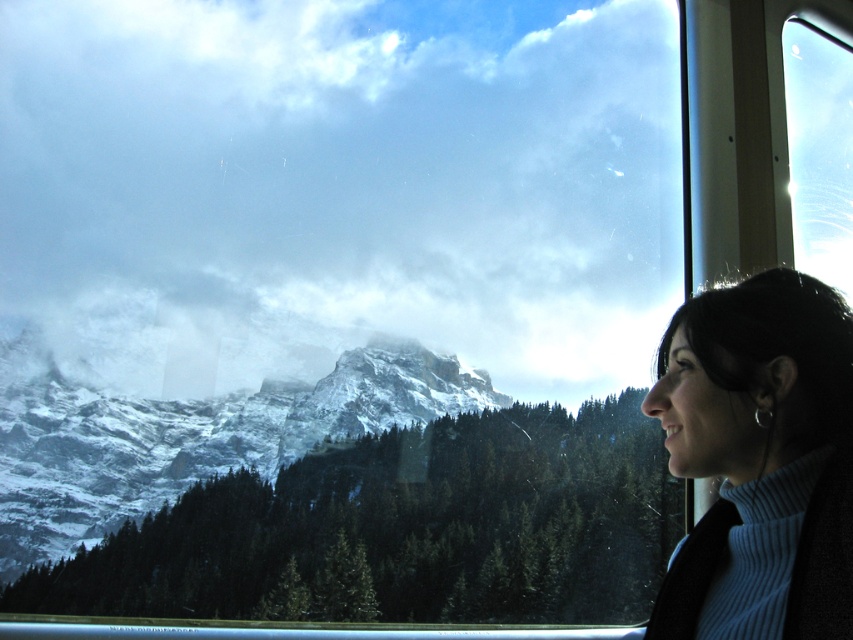
Question: Which is nearer to the transparent glass window at upper right?

Choices:
 (A) snowy rock mountain at center
 (B) light blue turtleneck sweater at right

Answer: (B)

Question: Which of the following is the farthest from the observer?

Choices:
 (A) (790, 561)
 (B) (39, 522)

Answer: (B)

Question: Is snowy rock mountain at center thinner than light blue turtleneck sweater at right?

Choices:
 (A) yes
 (B) no

Answer: (B)

Question: Does light blue turtleneck sweater at right have a lesser width compared to transparent glass window at upper right?

Choices:
 (A) yes
 (B) no

Answer: (A)

Question: Which object is the closest to the transparent glass window at upper right?

Choices:
 (A) light blue turtleneck sweater at right
 (B) snowy rock mountain at center

Answer: (A)

Question: Can you confirm if snowy rock mountain at center is positioned below transparent glass window at upper right?

Choices:
 (A) no
 (B) yes

Answer: (B)